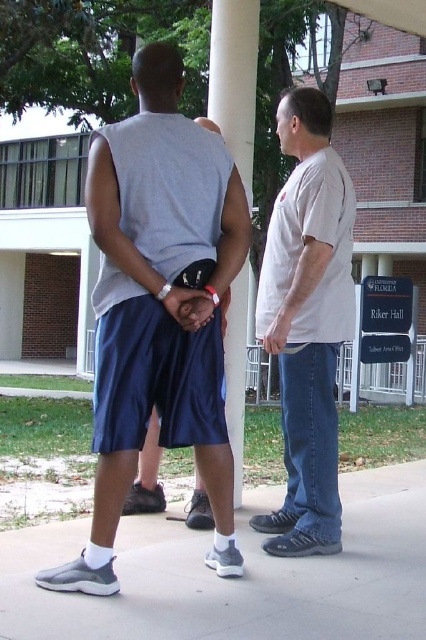
Based on the photo, you are a delivery person trying to place a small package on the ground between the gray rubber shoe at lower center and the matte gray concrete porch at center. Considering their sizes, will the package fit comfortably between them?

The gray rubber shoe at lower center has a smaller size compared to matte gray concrete porch at center, so the space between them should be sufficient to place the small package comfortably.

You are a delivery person trying to deliver a package to Riker Hall. You see the gray rubber shoe at lower center and the white smooth pillar at center. Which object is closer to the entrance of Riker Hall?

The gray rubber shoe at lower center is to the right of the white smooth pillar at center. Since the entrance is likely near the pillar, the white smooth pillar at center is closer to the entrance of Riker Hall.